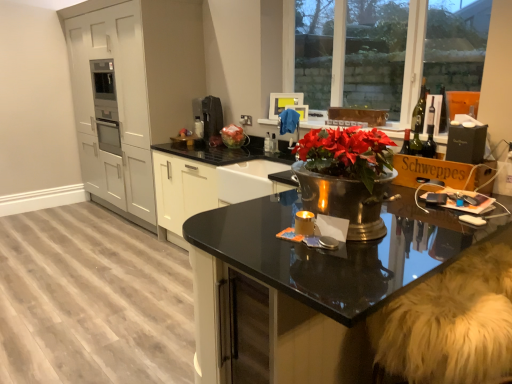
Question: Is green glass wine bottle at upper right aimed at clear glass window at upper right?

Choices:
 (A) no
 (B) yes

Answer: (A)

Question: Does green glass wine bottle at upper right have a smaller size compared to clear glass window at upper right?

Choices:
 (A) yes
 (B) no

Answer: (A)

Question: Is green glass wine bottle at upper right at the right side of clear glass window at upper right?

Choices:
 (A) no
 (B) yes

Answer: (B)

Question: Is the position of green glass wine bottle at upper right less distant than that of clear glass window at upper right?

Choices:
 (A) no
 (B) yes

Answer: (A)

Question: Considering the relative positions of green glass wine bottle at upper right and clear glass window at upper right in the image provided, is green glass wine bottle at upper right behind clear glass window at upper right?

Choices:
 (A) yes
 (B) no

Answer: (A)

Question: Does green glass wine bottle at upper right have a larger size compared to clear glass window at upper right?

Choices:
 (A) yes
 (B) no

Answer: (B)

Question: From the image's perspective, is white fur swivel chair at lower right beneath wooden cardboard box at right?

Choices:
 (A) no
 (B) yes

Answer: (B)

Question: Is white fur swivel chair at lower right smaller than wooden cardboard box at right?

Choices:
 (A) yes
 (B) no

Answer: (B)

Question: Is wooden cardboard box at right at the back of white fur swivel chair at lower right?

Choices:
 (A) yes
 (B) no

Answer: (B)

Question: Does white fur swivel chair at lower right come in front of wooden cardboard box at right?

Choices:
 (A) yes
 (B) no

Answer: (A)

Question: From a real-world perspective, is white fur swivel chair at lower right located higher than wooden cardboard box at right?

Choices:
 (A) yes
 (B) no

Answer: (B)

Question: Considering the relative sizes of white fur swivel chair at lower right and wooden cardboard box at right in the image provided, is white fur swivel chair at lower right wider than wooden cardboard box at right?

Choices:
 (A) no
 (B) yes

Answer: (B)

Question: Can you confirm if wooden cardboard box at right is wider than white fur swivel chair at lower right?

Choices:
 (A) yes
 (B) no

Answer: (B)